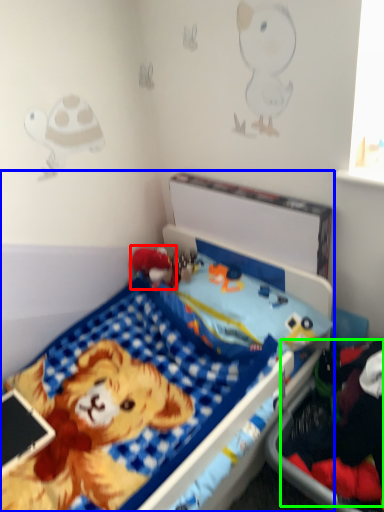
Question: Which is nearer to the toy (highlighted by a red box)? bed (highlighted by a blue box) or clothing (highlighted by a green box).

Choices:
 (A) bed
 (B) clothing

Answer: (A)